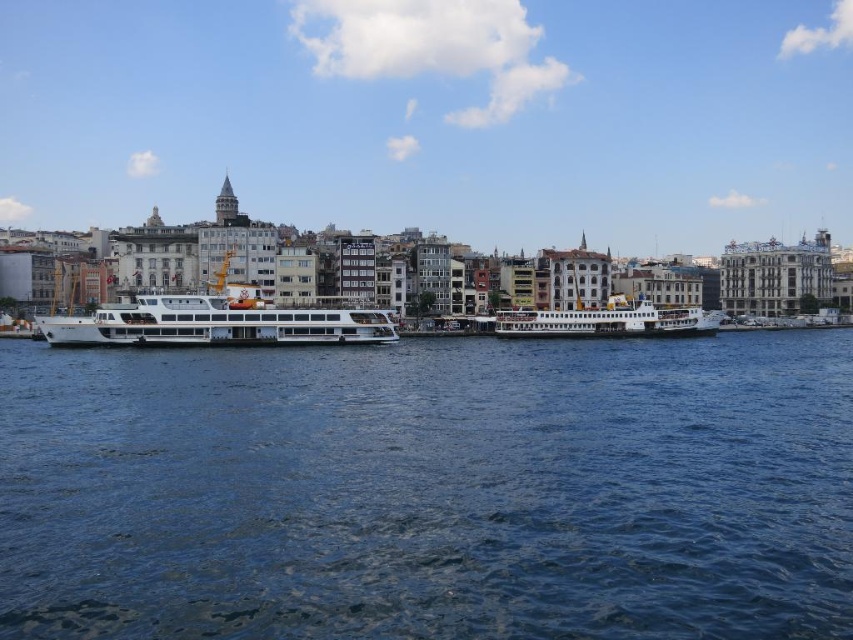
What are the coordinates of the white glossy cruise ship at center?

The white glossy cruise ship at center is located at coordinates point (213, 324).

You are a tour guide planning a route for a sightseeing boat that is 30 meters long. You need to navigate between the white glossy cruise ship at center and the white glossy ferry at center. Can the boat fit through the space between them?

The distance between the white glossy cruise ship at center and the white glossy ferry at center is 32.53 meters. Since the boat is 30 meters long, it can safely pass through the space between them as the distance is greater than the boat length.

You are standing at point (428, 490) in the image. What do you see directly in front of you?

At point (428, 490) lies blue water at center.